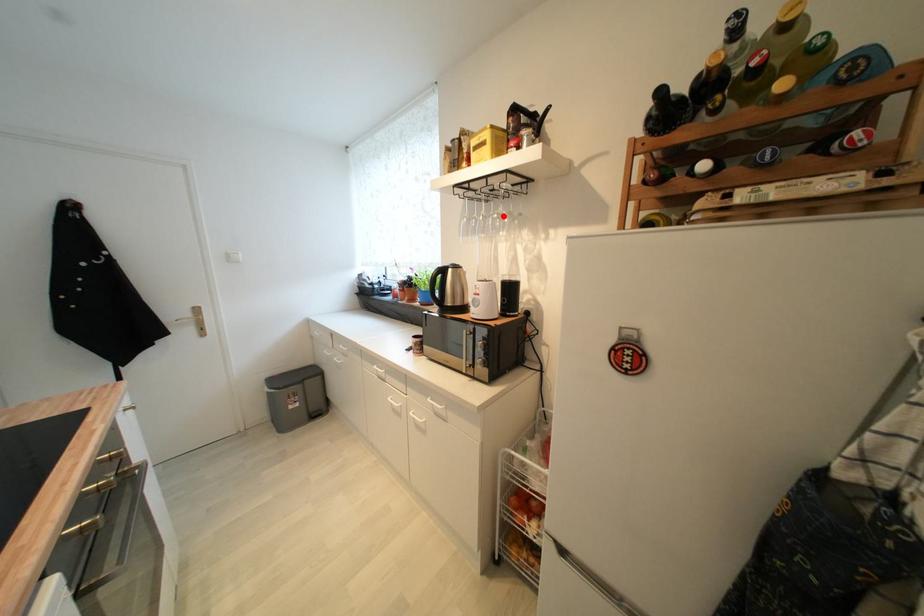
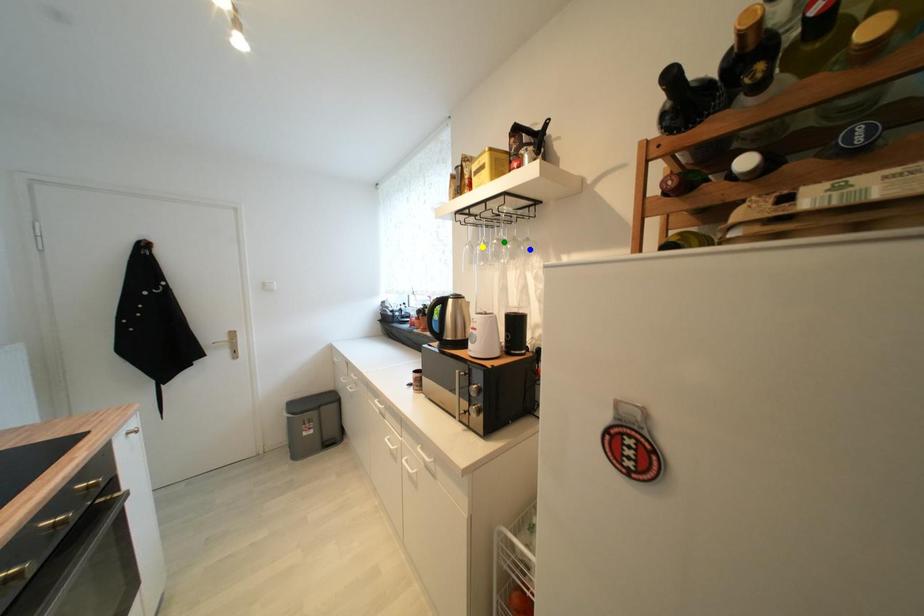
Question: I am providing you with two images of the same scene from different viewpoints. A red point is marked on the first image. You are given multiple points on the second image. Which point in image 2 is actually the same real-world point as the red point in image 1?

Choices:
 (A) blue point
 (B) yellow point
 (C) green point

Answer: (C)